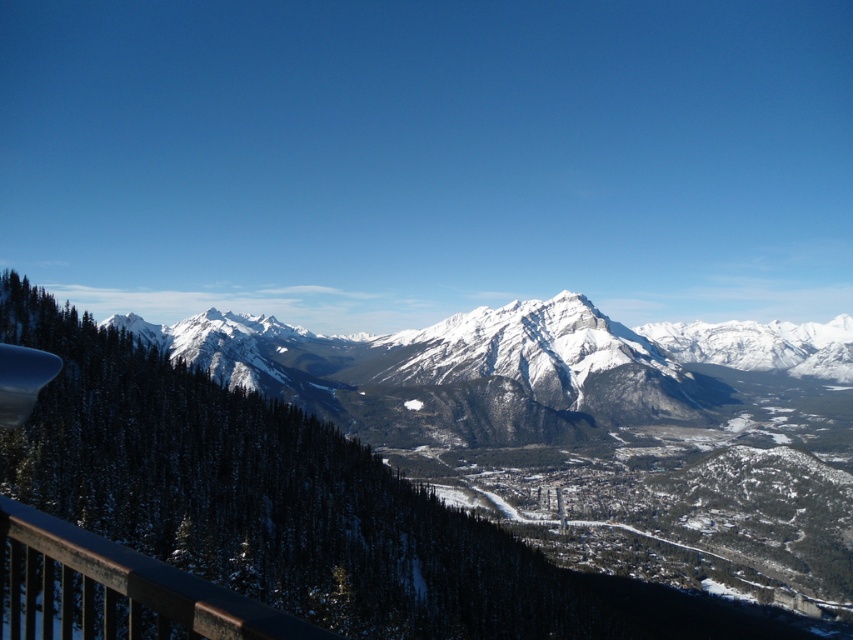
Is white snow-covered mountain range at center thinner than dark brown wooden rail at lower left?

No.

What do you see at coordinates (502, 369) in the screenshot? I see `white snow-covered mountain range at center` at bounding box center [502, 369].

Is point (339, 371) closer to viewer compared to point (142, 612)?

No, (339, 371) is behind (142, 612).

Find the location of a particular element. white snow-covered mountain range at center is located at coordinates (502, 369).

Can you confirm if snowy rocky mountain at center is positioned to the left of white snow-covered mountain range at center?

Correct, you'll find snowy rocky mountain at center to the left of white snow-covered mountain range at center.

Which is behind, point (816, 588) or point (543, 442)?

Point (543, 442)

This screenshot has height=640, width=853. What are the coordinates of `snowy rocky mountain at center` in the screenshot? It's located at (427, 484).

Is snowy rocky mountain at center positioned in front of dark brown wooden rail at lower left?

That is False.

Does snowy rocky mountain at center appear under dark brown wooden rail at lower left?

Yes.

The image size is (853, 640). In order to click on snowy rocky mountain at center in this screenshot , I will do `click(427, 484)`.